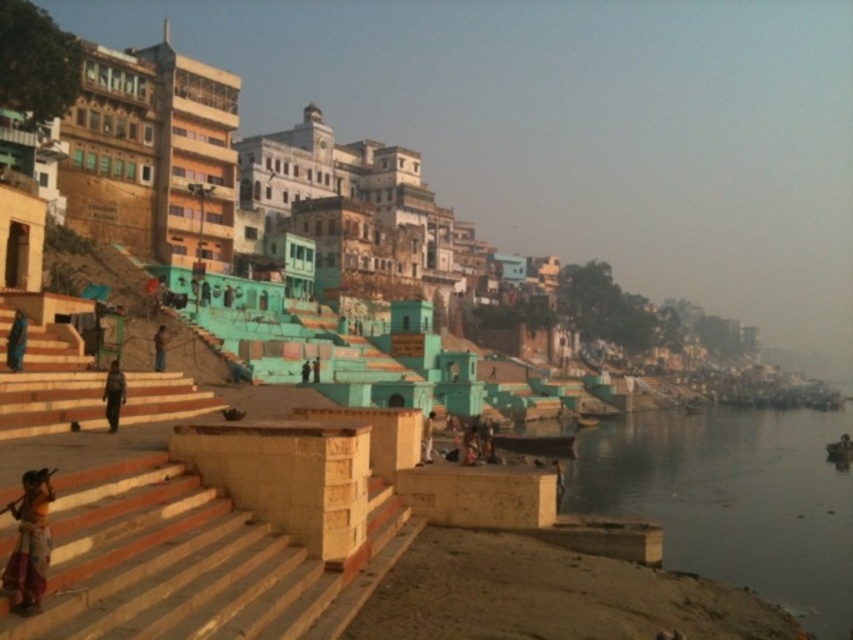
You are a photographer standing at the top of the stone steps in the riverside scene. You notice an orange cotton sari at lower left and a dark blue fabric person at center. Which of these two items is taller from your viewpoint?

The orange cotton sari at lower left is taller than the dark blue fabric person at center from your viewpoint.

You are standing at the riverside and want to take a photo of both the point at coordinates (13, 337) and the point at coordinates (428, 460). Which point should you focus on first to ensure both are in clear view?

You should focus on the point at coordinates (13, 337) first because it is closer to you than the point at coordinates (428, 460). This ensures both points are in clear view as the camera adjusts depth of field.

You are standing at the bottom of the stone steps in the riverside scene. You want to place your backpack on the ground near the brown leather bag at lower left. Where should you place your backpack?

Place your backpack near the brown leather bag at lower left at point (160, 348).